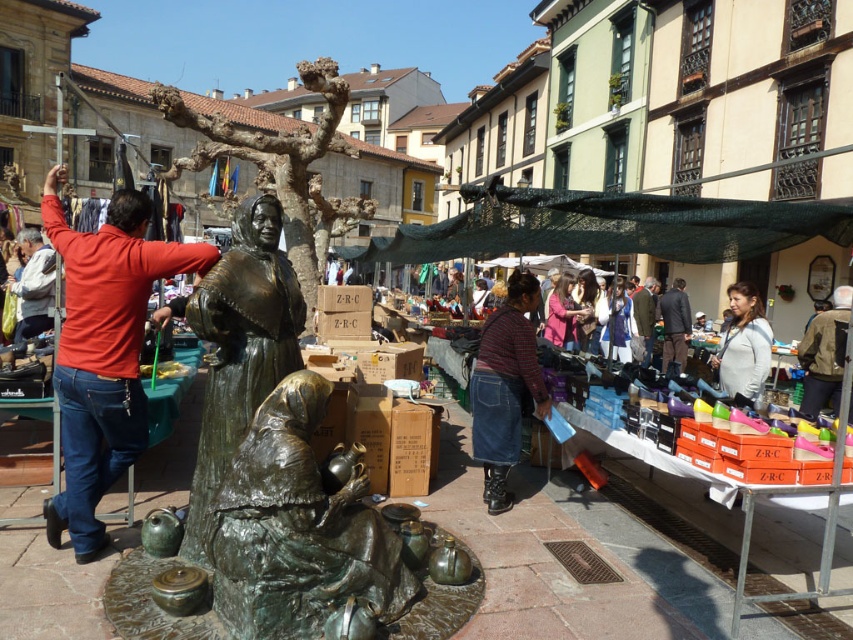
You are standing in the town square market and want to locate two specific points marked in the image. The first point is at coordinates point (105, 452) and the second is at point (245, 220). From your current position, which point is closer to you?

Point (245, 220) is closer to you because it is in front of point (105, 452).

You are a tourist visiting the market and see the red cotton shirt at left and the bronze statue at center. Which object takes up more visual space in the image?

The red cotton shirt at left takes up more visual space in the image because it is larger in size than the bronze statue at center.

You are a tourist standing in the European town square where the lively outdoor market is taking place. You want to take a photo of the bronze statue at center without any obstructions. Given that you are currently at point (239,346), which is the location of the statue, can you move to a position where you can clearly see the statue? Explain your reasoning.

The bronze statue at center is located at point (239,346). Since you are already at the statue, you cannot take a photo of it from that position. Move to a different location to capture the statue without obstruction.